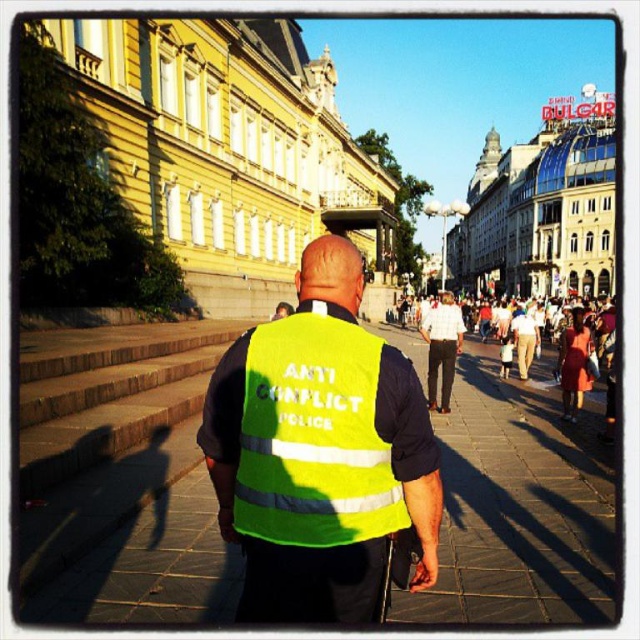
Is point (208, 582) positioned before point (323, 547)?

No, (208, 582) is behind (323, 547).

Can you confirm if yellow reflective vest at center is positioned to the left of neon yellow reflective vest at center?

In fact, yellow reflective vest at center is to the right of neon yellow reflective vest at center.

This screenshot has height=640, width=640. Identify the location of yellow reflective vest at center. (516, 509).

The image size is (640, 640). What do you see at coordinates (291, 528) in the screenshot?
I see `neon yellow reflective vest at center` at bounding box center [291, 528].

Is neon yellow reflective vest at center to the left of high-visibility fabric vest at center from the viewer's perspective?

In fact, neon yellow reflective vest at center is to the right of high-visibility fabric vest at center.

Where is `neon yellow reflective vest at center`? The image size is (640, 640). neon yellow reflective vest at center is located at coordinates (291, 528).

Is yellow reflective vest at center closer to camera compared to high-visibility fabric vest at center?

Yes.

Is yellow reflective vest at center above high-visibility fabric vest at center?

Actually, yellow reflective vest at center is below high-visibility fabric vest at center.

Between point (488, 385) and point (392, 500), which one is positioned in front?

Point (392, 500) is in front.

You are a GUI agent. You are given a task and a screenshot of the screen. Output one action in this format:
    pyautogui.click(x=<x>, y=<y>)
    Task: Click on the yellow reflective vest at center
    The image size is (640, 640).
    Given the screenshot: What is the action you would take?
    pyautogui.click(x=516, y=509)